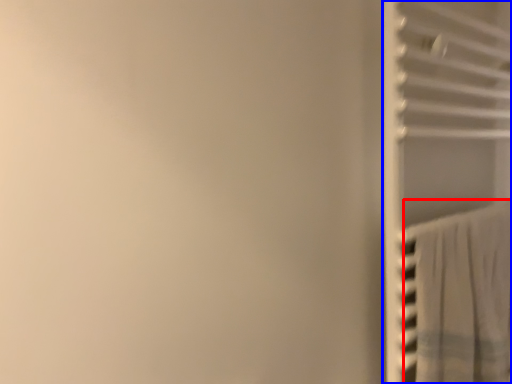
Question: Which point is further to the camera, curtain (highlighted by a red box) or closet (highlighted by a blue box)?

Choices:
 (A) curtain
 (B) closet

Answer: (A)